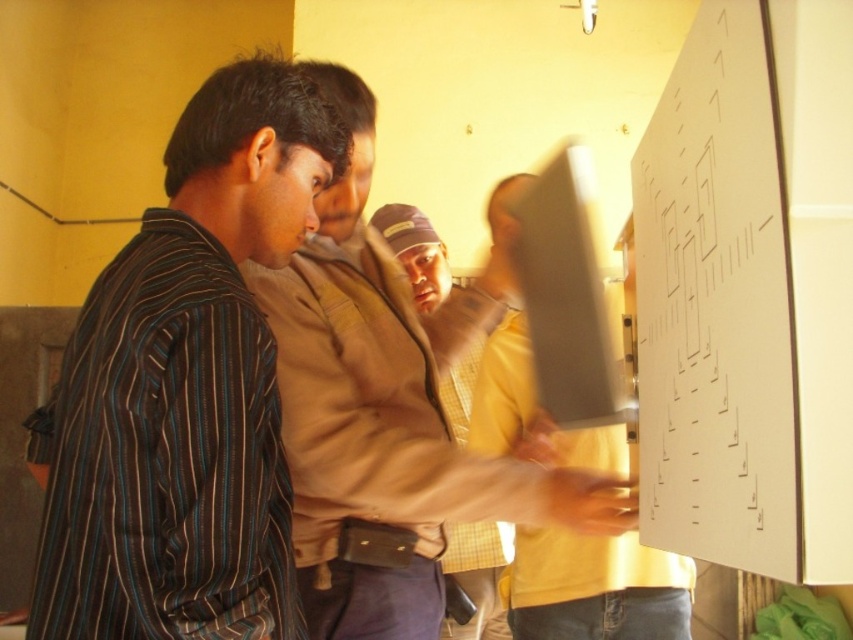
Question: Is striped fabric shirt at center thinner than white paperboard at upper right?

Choices:
 (A) no
 (B) yes

Answer: (A)

Question: Based on their relative distances, which object is nearer to the striped fabric shirt at center?

Choices:
 (A) white paperboard at upper right
 (B) striped fabric shirt at left

Answer: (B)

Question: Which of these objects is positioned closest to the striped fabric shirt at left?

Choices:
 (A) white paperboard at upper right
 (B) brown leather jacket at center

Answer: (A)

Question: Which object is positioned closest to the brown leather jacket at center?

Choices:
 (A) white paperboard at upper right
 (B) striped fabric shirt at left

Answer: (A)

Question: Is striped fabric shirt at left wider than striped fabric shirt at center?

Choices:
 (A) no
 (B) yes

Answer: (B)

Question: Can you confirm if striped fabric shirt at left is bigger than white paperboard at upper right?

Choices:
 (A) yes
 (B) no

Answer: (A)